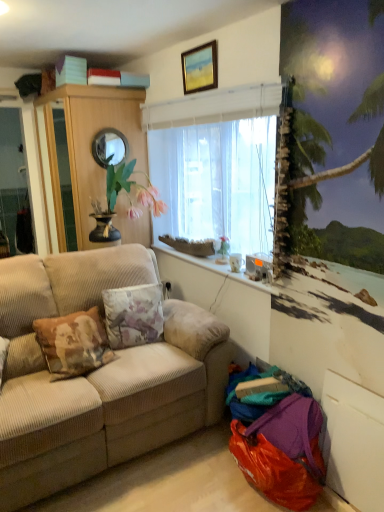
I want to click on white marble window sill at center, so click(199, 276).

Describe the element at coordinates (199, 276) in the screenshot. I see `white marble window sill at center` at that location.

Identify the location of floral fabric pillow at center. The width and height of the screenshot is (384, 512). (133, 315).

What do you see at coordinates (200, 68) in the screenshot?
I see `wooden picture frame at upper center` at bounding box center [200, 68].

The width and height of the screenshot is (384, 512). What are the coordinates of `wooden picture frame at upper center` in the screenshot? It's located at (200, 68).

Where is `beige corduroy couch at left`? Image resolution: width=384 pixels, height=512 pixels. beige corduroy couch at left is located at coordinates (98, 376).

Describe the element at coordinates (98, 376) in the screenshot. The image size is (384, 512). I see `beige corduroy couch at left` at that location.

What do you see at coordinates (84, 149) in the screenshot? I see `wooden cabinet at left` at bounding box center [84, 149].

Locate an element on the screen. This screenshot has height=512, width=384. white marble window sill at center is located at coordinates (199, 276).

Could you tell me if translucent fabric at center is facing shiny silver mirror at upper center?

Yes, translucent fabric at center is turned towards shiny silver mirror at upper center.

From a real-world perspective, is translucent fabric at center above or below shiny silver mirror at upper center?

translucent fabric at center is below shiny silver mirror at upper center.

Can you see floral fabric pillow at center touching translucent fabric at center?

No, floral fabric pillow at center is not with translucent fabric at center.

Based on the photo, is floral fabric pillow at center situated inside translucent fabric at center or outside?

floral fabric pillow at center is located beyond the bounds of translucent fabric at center.

From the image's perspective, does floral fabric pillow at center appear higher than translucent fabric at center?

No.

Between floral fabric pillow at center and translucent fabric at center, which one is positioned behind?

floral fabric pillow at center.

Consider the image. Which of these two, floral fabric pillow at center or white marble window sill at center, is smaller?

Smaller between the two is white marble window sill at center.

From a real-world perspective, which is physically above, floral fabric pillow at center or white marble window sill at center?

In real-world perspective, white marble window sill at center is above.

Which is behind, point (140, 323) or point (163, 264)?

Positioned behind is point (163, 264).

Is floral fabric pillow at center further to camera compared to white marble window sill at center?

Yes, floral fabric pillow at center is further from the viewer.

Considering the relative sizes of shiny silver mirror at upper center and white glossy coffee cup at lower right in the image provided, is shiny silver mirror at upper center bigger than white glossy coffee cup at lower right?

Yes.

Is point (107, 156) behind point (236, 253)?

That is True.

In terms of height, does shiny silver mirror at upper center look taller or shorter compared to white glossy coffee cup at lower right?

shiny silver mirror at upper center is taller than white glossy coffee cup at lower right.

From the image's perspective, relative to white glossy coffee cup at lower right, is shiny silver mirror at upper center above or below?

From the image's perspective, shiny silver mirror at upper center appears above white glossy coffee cup at lower right.

What's the angular difference between beige corduroy couch at left and white marble window sill at center's facing directions?

The angular difference between beige corduroy couch at left and white marble window sill at center is 90 degrees.

In the scene shown: From the image's perspective, is beige corduroy couch at left beneath white marble window sill at center?

Correct, beige corduroy couch at left appears lower than white marble window sill at center in the image.

Is point (9, 359) less distant than point (247, 278)?

Yes, it is in front of point (247, 278).

Considering the relative sizes of beige corduroy couch at left and white marble window sill at center in the image provided, is beige corduroy couch at left shorter than white marble window sill at center?

In fact, beige corduroy couch at left may be taller than white marble window sill at center.

Considering the sizes of translucent fabric at center and floral fabric pillow at center in the image, is translucent fabric at center bigger or smaller than floral fabric pillow at center?

Considering their sizes, translucent fabric at center takes up more space than floral fabric pillow at center.

Looking at this image, is translucent fabric at center taller or shorter than floral fabric pillow at center?

translucent fabric at center is taller than floral fabric pillow at center.

How much distance is there between translucent fabric at center and floral fabric pillow at center?

They are 35.60 inches apart.

Is point (149, 153) farther from camera compared to point (115, 337)?

That is True.

Considering the relative positions of shiny silver mirror at upper center and wooden picture frame at upper center in the image provided, is shiny silver mirror at upper center to the left of wooden picture frame at upper center from the viewer's perspective?

Answer: Correct, you'll find shiny silver mirror at upper center to the left of wooden picture frame at upper center.

From a real-world perspective, between shiny silver mirror at upper center and wooden picture frame at upper center, who is vertically lower?

shiny silver mirror at upper center.

Considering the relative sizes of shiny silver mirror at upper center and wooden picture frame at upper center in the image provided, is shiny silver mirror at upper center thinner than wooden picture frame at upper center?

No.

Is shiny silver mirror at upper center facing towards wooden picture frame at upper center?

No, shiny silver mirror at upper center is not turned towards wooden picture frame at upper center.

Where is `window below the shiny silver mirror at upper center (from a real-world perspective)`? This screenshot has width=384, height=512. window below the shiny silver mirror at upper center (from a real-world perspective) is located at coordinates (217, 167).

In order to click on window above the floral fabric pillow at center (from a real-world perspective) in this screenshot , I will do `click(217, 167)`.

Considering their positions, is wooden cabinet at left positioned closer to floral fabric pillow at center than wooden picture frame at upper center?

wooden cabinet at left.

Estimate the real-world distances between objects in this image. Which object is closer to beige corduroy couch at left, translucent fabric at center or floral fabric pillow at center?

Based on the image, floral fabric pillow at center appears to be nearer to beige corduroy couch at left.

Considering their positions, is wooden picture frame at upper center positioned closer to wooden cabinet at left than white glossy coffee cup at lower right?

Based on the image, wooden picture frame at upper center appears to be nearer to wooden cabinet at left.

Considering their positions, is wooden picture frame at upper center positioned further to white glossy coffee cup at lower right than wooden cabinet at left?

wooden cabinet at left is positioned further to the anchor white glossy coffee cup at lower right.

Considering their positions, is shiny silver mirror at upper center positioned closer to beige corduroy couch at left than white marble window sill at center?

white marble window sill at center.

Based on their spatial positions, is translucent fabric at center or white glossy coffee cup at lower right further from wooden picture frame at upper center?

white glossy coffee cup at lower right lies further to wooden picture frame at upper center than the other object.

From the image, which object appears to be farther from shiny silver mirror at upper center, translucent fabric at center or white marble window sill at center?

white marble window sill at center is further to shiny silver mirror at upper center.

In the scene shown: Looking at the image, which one is located further to wooden cabinet at left, floral fabric pillow at center or shiny silver mirror at upper center?

floral fabric pillow at center.

I want to click on coffee cup between translucent fabric at center and floral fabric pillow at center vertically, so click(x=235, y=262).

At what (x,y) coordinates should I click in order to perform the action: click on window sill that lies between translucent fabric at center and floral fabric pillow at center from top to bottom. Please return your answer as a coordinate pair (x, y). This screenshot has height=512, width=384. Looking at the image, I should click on (199, 276).

I want to click on mirror between wooden picture frame at upper center and white marble window sill at center in the up-down direction, so click(109, 147).

The width and height of the screenshot is (384, 512). Identify the location of coffee cup between wooden picture frame at upper center and beige corduroy couch at left in the up-down direction. (235, 262).